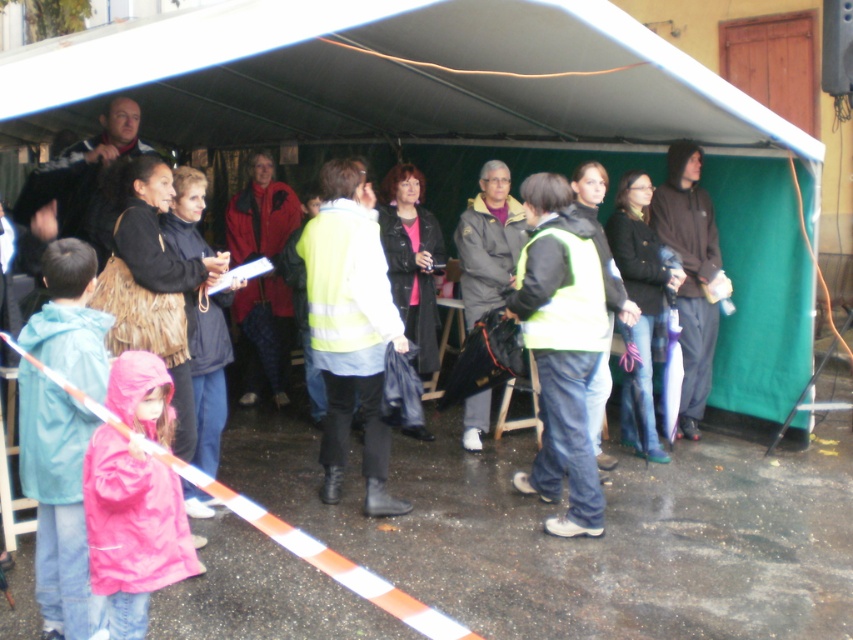
You are a photographer trying to capture a photo of the dark brown hoodie at right and the matte gray jacket at center. Since you want both subjects to appear in the frame, which one should you focus on first to ensure they are both in the shot?

The dark brown hoodie at right is much taller than the matte gray jacket at center, so focusing on the taller dark brown hoodie at right first will help ensure both are in the frame.

You are a safety officer at the event. You need to ensure that the matte gray jacket at center is visible to everyone under the white fabric tent at center. Based on their positions, can you confirm if the jacket is visible from underneath the tent?

The white fabric tent at center is located above the matte gray jacket at center, so the jacket is visible from underneath the tent as it is positioned below the tent structure.